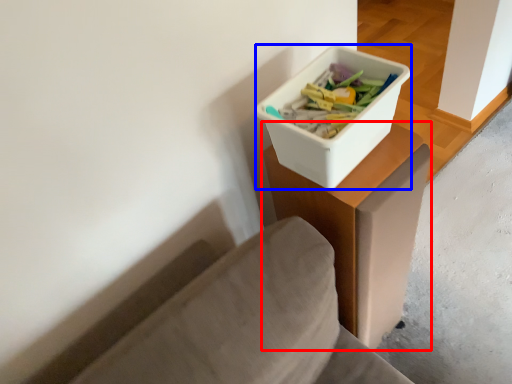
Question: Which of the following is the closest to the observer, table (highlighted by a red box) or storage box (highlighted by a blue box)?

Choices:
 (A) table
 (B) storage box

Answer: (B)